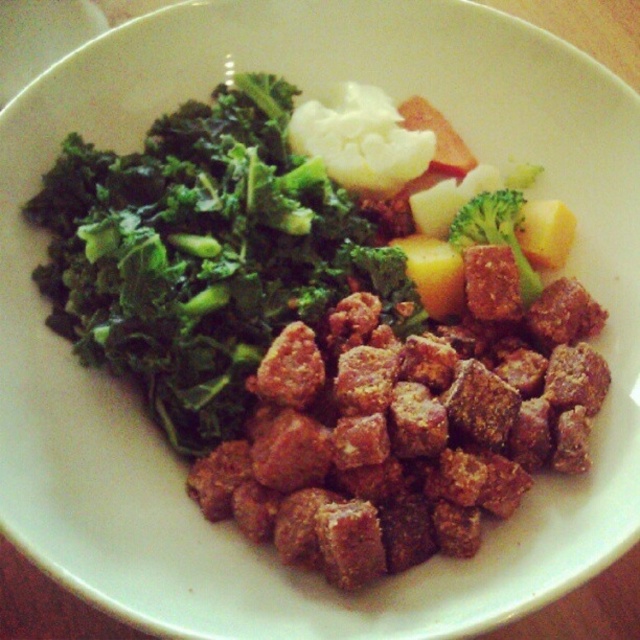
Describe the element at coordinates (406, 428) in the screenshot. I see `brown crumbly meat at bottom` at that location.

Is brown crumbly meat at bottom in front of green leafymaterial/texturevegetable at upper left?

Yes.

Who is more forward, (426, 340) or (220, 196)?

Point (426, 340)

The height and width of the screenshot is (640, 640). Identify the location of brown crumbly meat at bottom. (406, 428).

Who is positioned more to the right, green leafymaterial/texturevegetable at upper left or green matte broccoli at upper center?

Positioned to the right is green matte broccoli at upper center.

Which is in front, point (76, 301) or point (513, 230)?

Point (76, 301)

Locate an element on the screen. green leafymaterial/texturevegetable at upper left is located at coordinates (204, 256).

Looking at this image, is brown crumbly meat at bottom below green matte broccoli at upper center?

Indeed, brown crumbly meat at bottom is positioned under green matte broccoli at upper center.

Between brown crumbly meat at bottom and green matte broccoli at upper center, which one has more height?

Standing taller between the two is brown crumbly meat at bottom.

What do you see at coordinates (406, 428) in the screenshot? I see `brown crumbly meat at bottom` at bounding box center [406, 428].

What are the coordinates of `brown crumbly meat at bottom` in the screenshot? It's located at (406, 428).